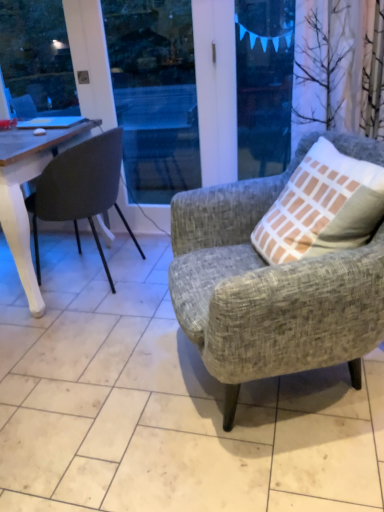
Identify the location of free space underneath matte black chair at left, positioned as the 2th chair in right-to-left order (from a real-world perspective). This screenshot has width=384, height=512. (82, 278).